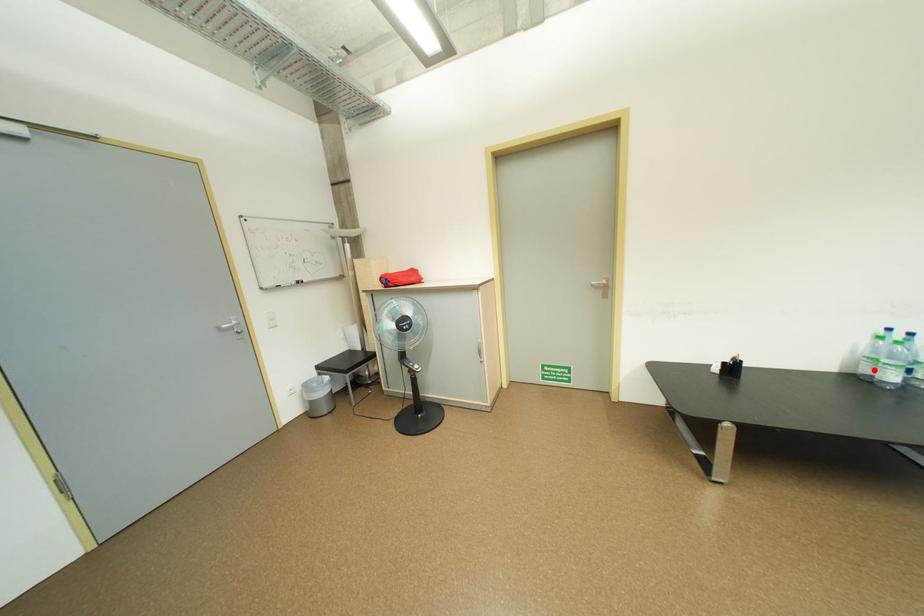
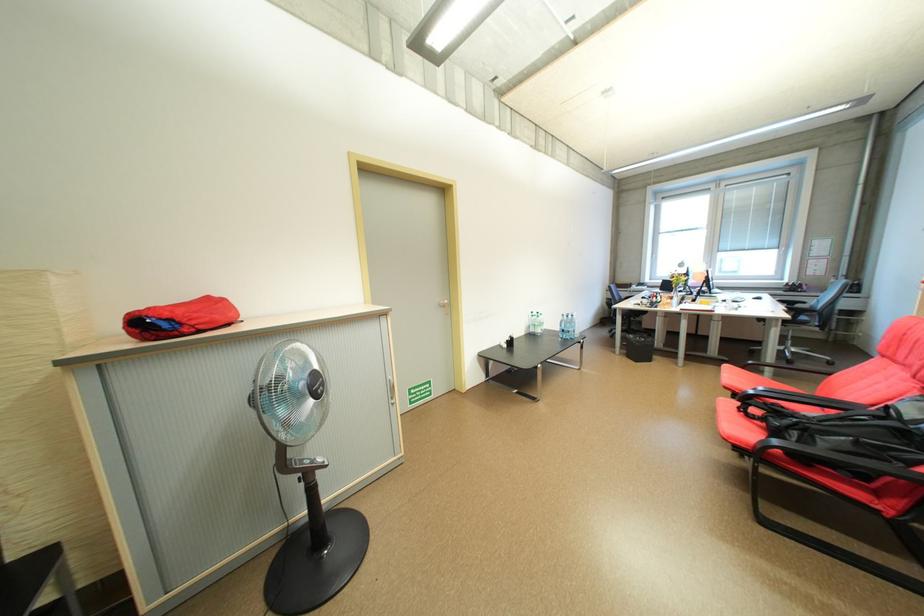
In the second image, find the point that corresponds to the highlighted location in the first image.

(541, 331)